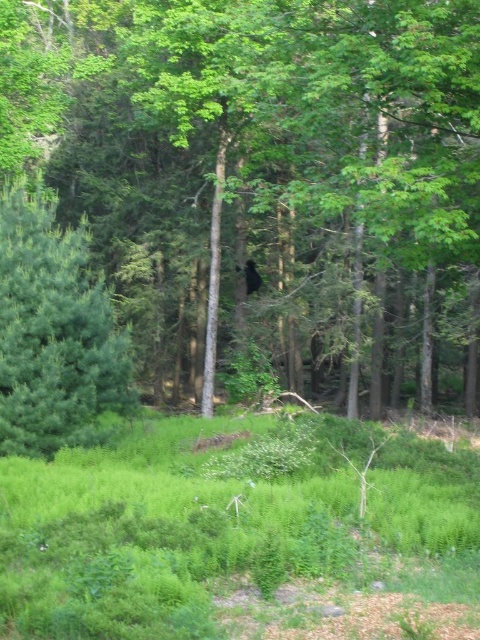
Based on the photo, you are a bird flying over the forest. You see the green leafy tree at center and the green leafy grass at center. Which one is higher from the ground?

The green leafy tree at center is higher from the ground than the green leafy grass at center because it is positioned above it in the scene.

In the scene shown: You are a photographer standing in the forest and want to take a photo of the green leafy tree at center. If your camera has a maximum focus range of 10 meters, will you be able to focus on the tree?

The green leafy tree at center is 10.47 meters from camera, which is beyond the camera maximum focus range of 10 meters. Therefore, the camera cannot focus on the tree.

You are standing in the forest and want to take a photo. There are two points of interest marked as point (243, 531) and point (45, 337). Which point will appear larger in your photo?

Point (243, 531) is closer to the camera than point (45, 337), so it will appear larger in the photo.